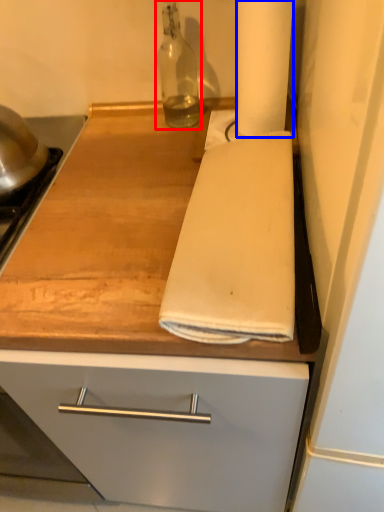
Question: Which object appears closest to the camera in this image, bottle (highlighted by a red box) or paper towel (highlighted by a blue box)?

Choices:
 (A) bottle
 (B) paper towel

Answer: (B)